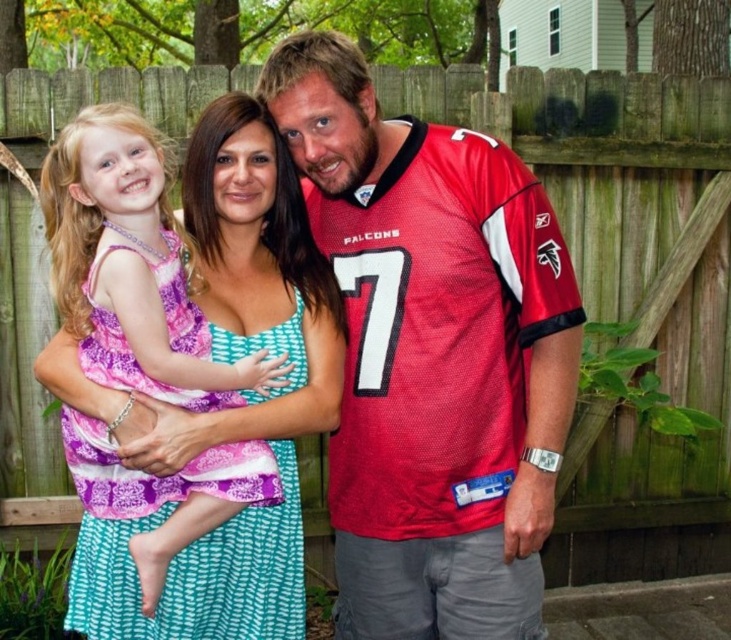
Is point (292, 61) positioned behind point (83, 552)?

That is False.

Who is positioned more to the left, red jersey at center or purple printed fabric dress at center?

purple printed fabric dress at center is more to the left.

Who is more forward, [281,124] or [87,289]?

Point [87,289] is in front.

You are a GUI agent. You are given a task and a screenshot of the screen. Output one action in this format:
    pyautogui.click(x=<x>, y=<y>)
    Task: Click on the red jersey at center
    
    Given the screenshot: What is the action you would take?
    pyautogui.click(x=431, y=355)